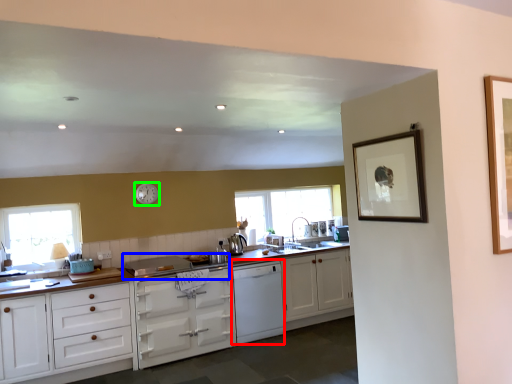
Question: Which object is positioned farthest from dish washer (highlighted by a red box)? Select from gas stove (highlighted by a blue box) and clock (highlighted by a green box).

Choices:
 (A) gas stove
 (B) clock

Answer: (B)